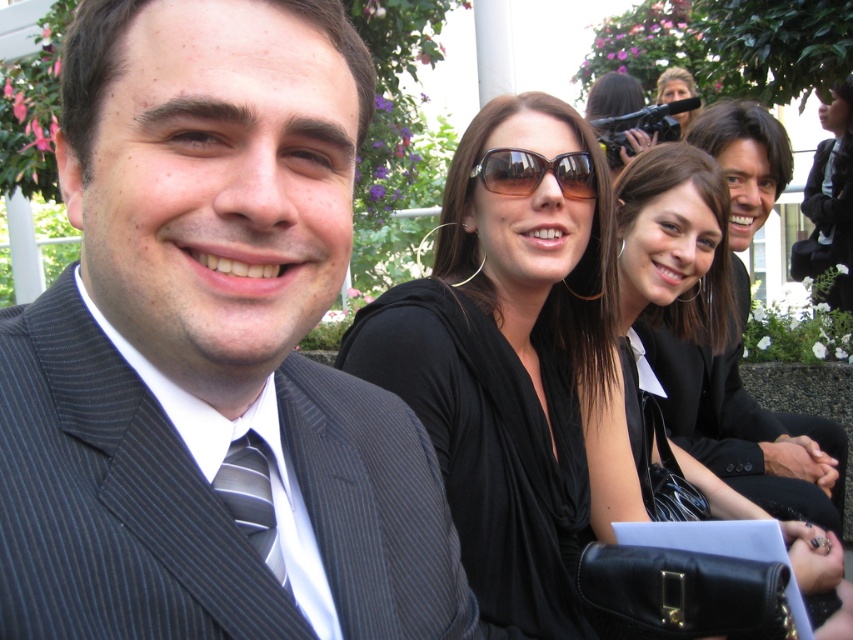
Which of these two, black satin dress at center or sunglasses at upper center, stands shorter?

Standing shorter between the two is sunglasses at upper center.

Does black satin dress at center come behind sunglasses at upper center?

That is False.

Is point (537, 387) behind point (692, 116)?

No, (537, 387) is in front of (692, 116).

Where is `black satin dress at center`? This screenshot has height=640, width=853. black satin dress at center is located at coordinates (508, 364).

Does pinstriped suit at center have a greater width compared to striped fabric tie at left?

Yes.

Is pinstriped suit at center thinner than striped fabric tie at left?

Incorrect, pinstriped suit at center's width is not less than striped fabric tie at left's.

You are a GUI agent. You are given a task and a screenshot of the screen. Output one action in this format:
    pyautogui.click(x=<x>, y=<y>)
    Task: Click on the pinstriped suit at center
    
    Given the screenshot: What is the action you would take?
    coord(260,282)

From the picture: Can you confirm if smooth black suit at right is shorter than striped fabric tie at left?

Incorrect, smooth black suit at right's height does not fall short of striped fabric tie at left's.

Which is behind, point (730, 125) or point (245, 486)?

The point (730, 125) is more distant.

Who is more forward, (651, 364) or (250, 429)?

Positioned in front is point (250, 429).

The height and width of the screenshot is (640, 853). I want to click on smooth black suit at right, so click(741, 348).